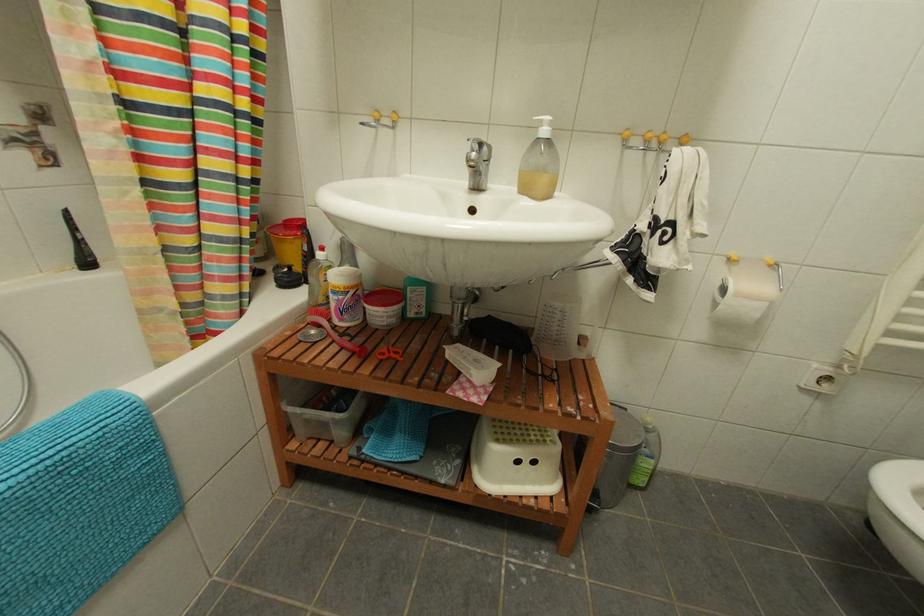
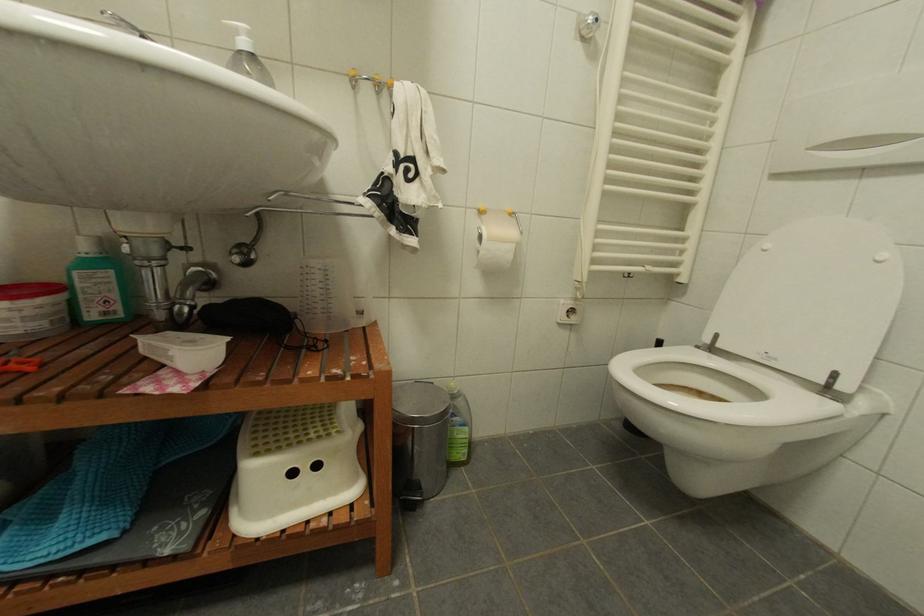
Question: The images are taken continuously from a first-person perspective. In which direction is your viewpoint rotating?

Choices:
 (A) Left
 (B) Right
 (C) Up
 (D) Down

Answer: (B)